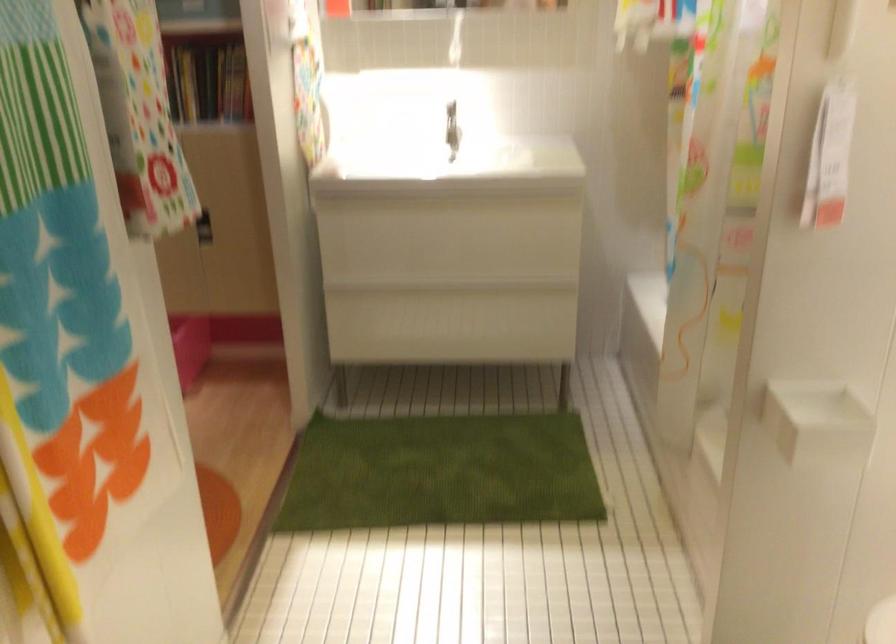
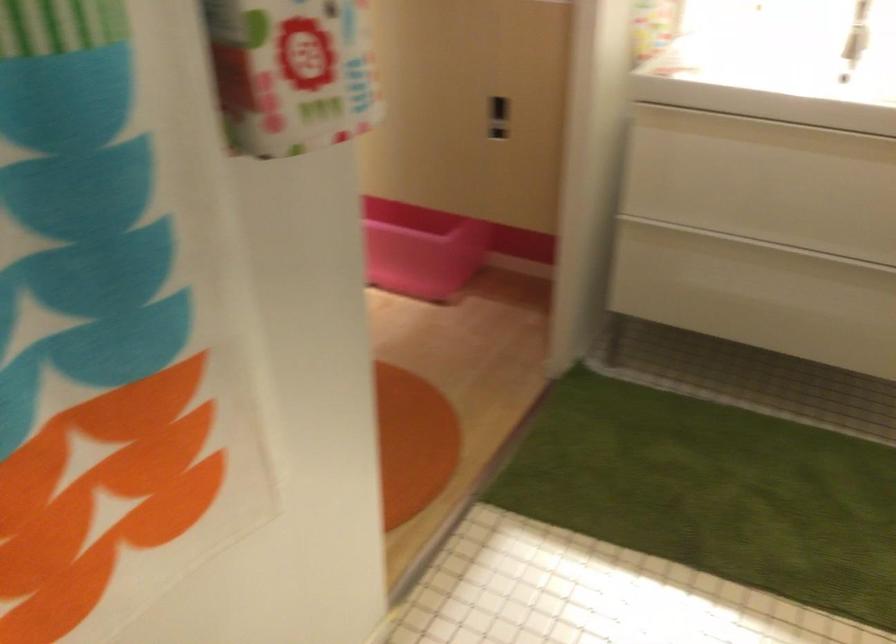
In the second image, find the point that corresponds to [409,212] in the first image.

(764, 131)